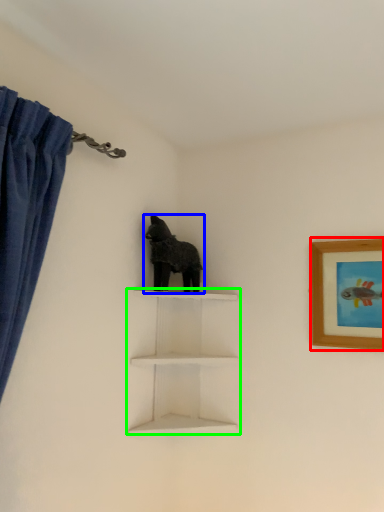
Question: Based on their relative distances, which object is farther from picture frame (highlighted by a red box)? Choose from animal (highlighted by a blue box) and shelf (highlighted by a green box).

Choices:
 (A) animal
 (B) shelf

Answer: (A)